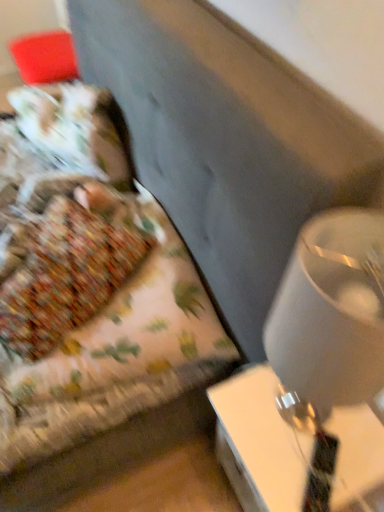
Question: Does white glossy lampshade at right have a greater height compared to white glossy table at lower right?

Choices:
 (A) yes
 (B) no

Answer: (A)

Question: Considering the relative sizes of white glossy lampshade at right and white glossy table at lower right in the image provided, is white glossy lampshade at right bigger than white glossy table at lower right?

Choices:
 (A) yes
 (B) no

Answer: (B)

Question: From the image's perspective, does white glossy lampshade at right appear lower than white glossy table at lower right?

Choices:
 (A) yes
 (B) no

Answer: (B)

Question: From the image's perspective, does white glossy lampshade at right appear higher than white glossy table at lower right?

Choices:
 (A) no
 (B) yes

Answer: (B)

Question: Does white glossy lampshade at right have a smaller size compared to white glossy table at lower right?

Choices:
 (A) no
 (B) yes

Answer: (B)

Question: Is white glossy lampshade at right positioned in front of white glossy table at lower right?

Choices:
 (A) yes
 (B) no

Answer: (A)

Question: Can floral fabric bed at left be found inside white glossy table at lower right?

Choices:
 (A) no
 (B) yes

Answer: (A)

Question: From the image's perspective, is white glossy table at lower right over floral fabric bed at left?

Choices:
 (A) no
 (B) yes

Answer: (A)

Question: Does white glossy table at lower right have a larger size compared to floral fabric bed at left?

Choices:
 (A) yes
 (B) no

Answer: (B)

Question: Can we say white glossy table at lower right lies outside floral fabric bed at left?

Choices:
 (A) no
 (B) yes

Answer: (B)

Question: Does white glossy table at lower right turn towards floral fabric bed at left?

Choices:
 (A) yes
 (B) no

Answer: (B)

Question: From the image's perspective, is white glossy table at lower right located beneath floral fabric bed at left?

Choices:
 (A) no
 (B) yes

Answer: (B)

Question: Does white glossy lampshade at right appear on the right side of floral fabric bed at left?

Choices:
 (A) no
 (B) yes

Answer: (B)